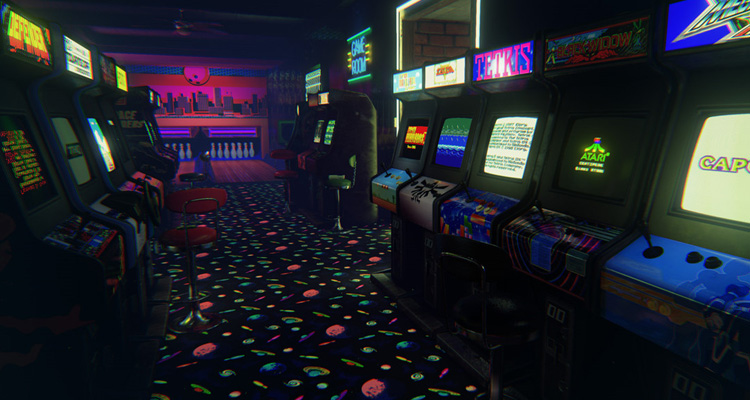
This screenshot has width=750, height=400. Find the location of `ceiling`. ceiling is located at coordinates (259, 25).